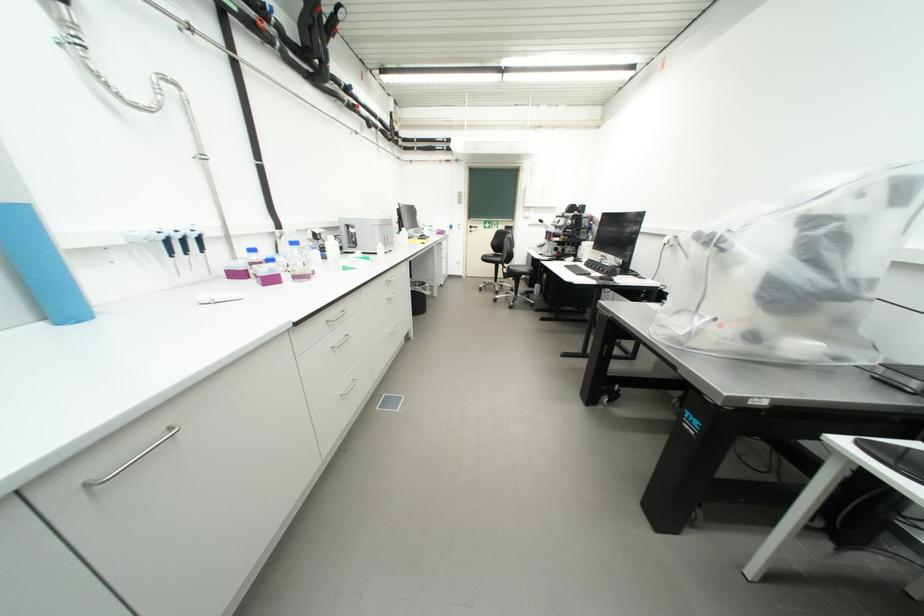
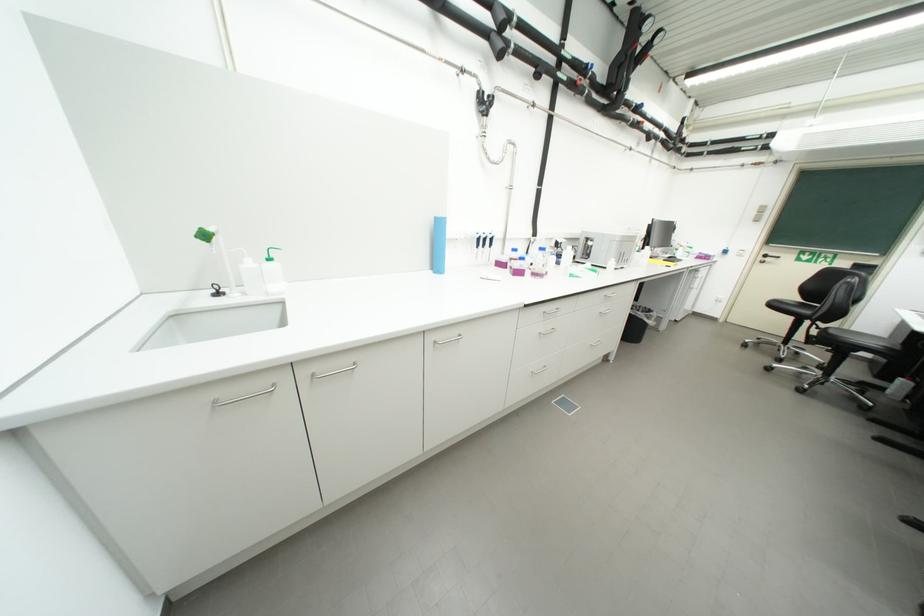
Find the pixel in the second image that matches (x=95, y=487) in the first image.

(443, 344)